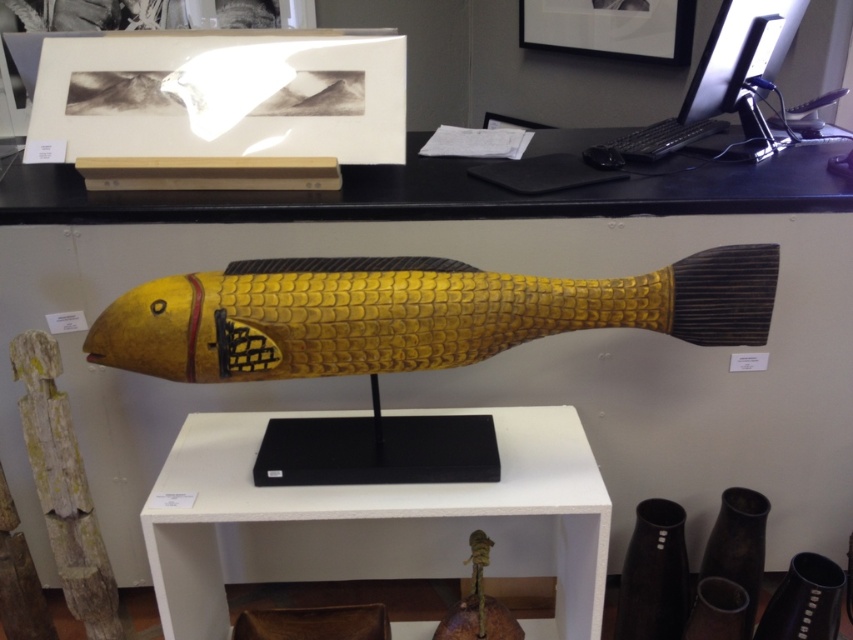
You are an art curator planning to install a new exhibit. You have a sculpture that requires a display surface taller than the black plastic monitor at upper right. Can the white matte shelf at center accommodate it?

The white matte shelf at center is taller than the black plastic monitor at upper right, so it can accommodate the sculpture requiring a taller display surface.

You are an art curator planning to move the yellow wood fish at center and the black plastic monitor at upper right to a new exhibition space. The new space has a narrow shelf that can only accommodate items up to 50 cm in width. Based on the current dimensions, which of the two items might not fit on the shelf?

The yellow wood fish at center has a larger width than the black plastic monitor at upper right. Since the shelf can only accommodate items up to 50 cm, the yellow wood fish at center might not fit on the shelf if its width exceeds 50 cm, while the monitor could potentially fit.

You are an art curator arranging items in the gallery. You have a small vase that needs to be placed on the white matte shelf at center or the yellow wood fish at center. Which object should you choose to ensure the vase is positioned to the left of the fish?

You should place the vase on the white matte shelf at center because the white matte shelf at center is already positioned to the left of the yellow wood fish at center.